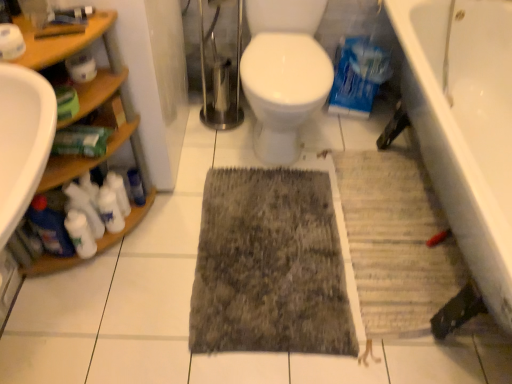
You are a GUI agent. You are given a task and a screenshot of the screen. Output one action in this format:
    pyautogui.click(x=<x>, y=<y>)
    Task: Click on the vacant space in front of white matte cleaning products at lower left, which is counted as the 3th cleaning product, starting from the left
    The height and width of the screenshot is (384, 512).
    Given the screenshot: What is the action you would take?
    pyautogui.click(x=111, y=271)